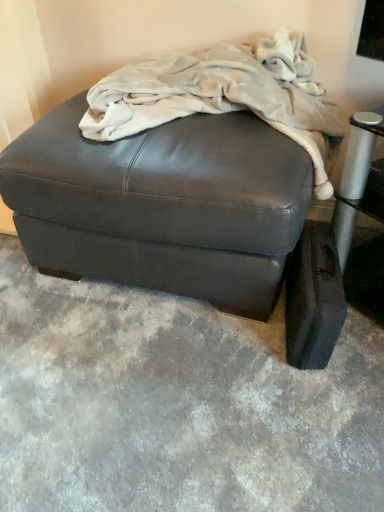
The height and width of the screenshot is (512, 384). In order to click on vacant area on top of leather ottoman at lower right (from a real-world perspective) in this screenshot , I will do `click(316, 266)`.